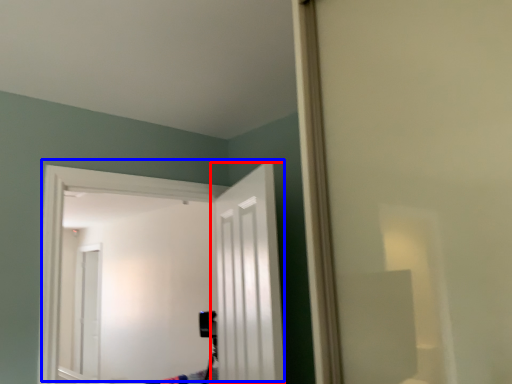
Question: Which point is closer to the camera, door (highlighted by a red box) or door (highlighted by a blue box)?

Choices:
 (A) door
 (B) door

Answer: (A)